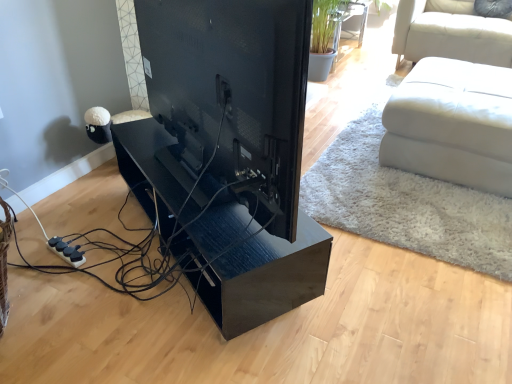
Question: In terms of height, does black glossy tv at center look taller or shorter compared to glossy wood table at center?

Choices:
 (A) tall
 (B) short

Answer: (A)

Question: Do you think black glossy tv at center is within glossy wood table at center, or outside of it?

Choices:
 (A) inside
 (B) outside

Answer: (B)

Question: Based on their relative distances, which object is farther from the black glossy tv at center?

Choices:
 (A) white leather ottoman at right
 (B) glossy wood table at center

Answer: (A)

Question: Which object is the farthest from the black glossy tv at center?

Choices:
 (A) glossy wood table at center
 (B) white leather ottoman at right

Answer: (B)